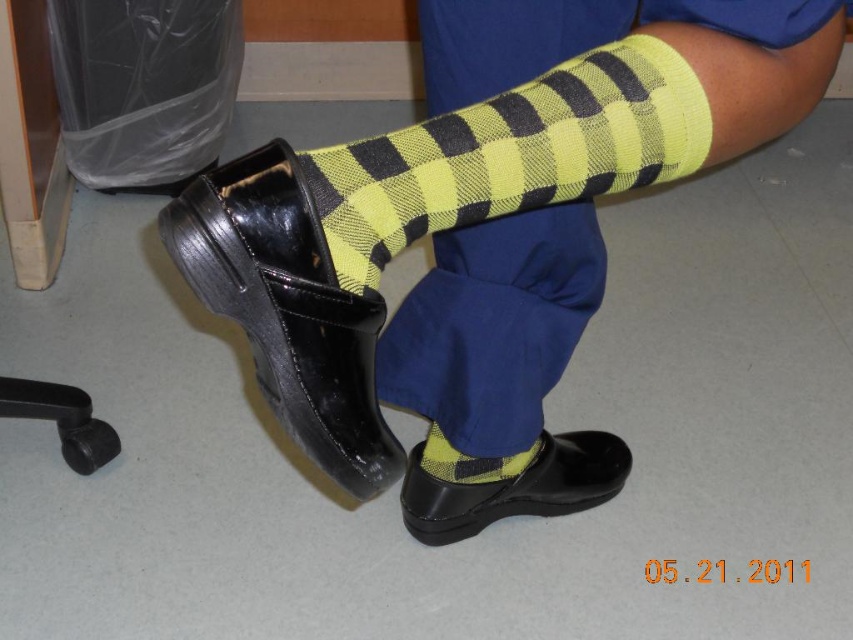
Question: Estimate the real-world distances between objects in this image. Which object is closer to the matte black shoe at lower center?

Choices:
 (A) black rubber heel at lower left
 (B) yellow checkered socks at center
 (C) yellow checkered sock at lower center
 (D) shiny black shoe at lower center

Answer: (C)

Question: Which point is farther from the camera taking this photo?

Choices:
 (A) (669, 128)
 (B) (430, 502)
 (C) (503, 360)
 (D) (323, 440)

Answer: (B)

Question: Among these objects, which one is nearest to the camera?

Choices:
 (A) yellow checkered socks at center
 (B) matte black shoe at lower center

Answer: (A)

Question: Can you confirm if yellow checkered socks at center is thinner than yellow checkered sock at lower center?

Choices:
 (A) yes
 (B) no

Answer: (B)

Question: From the image, what is the correct spatial relationship of yellow checkered sock at center in relation to yellow/black checkered sock at center?

Choices:
 (A) above
 (B) below

Answer: (B)

Question: Does yellow checkered socks at center have a greater width compared to yellow/black checkered sock at center?

Choices:
 (A) no
 (B) yes

Answer: (B)